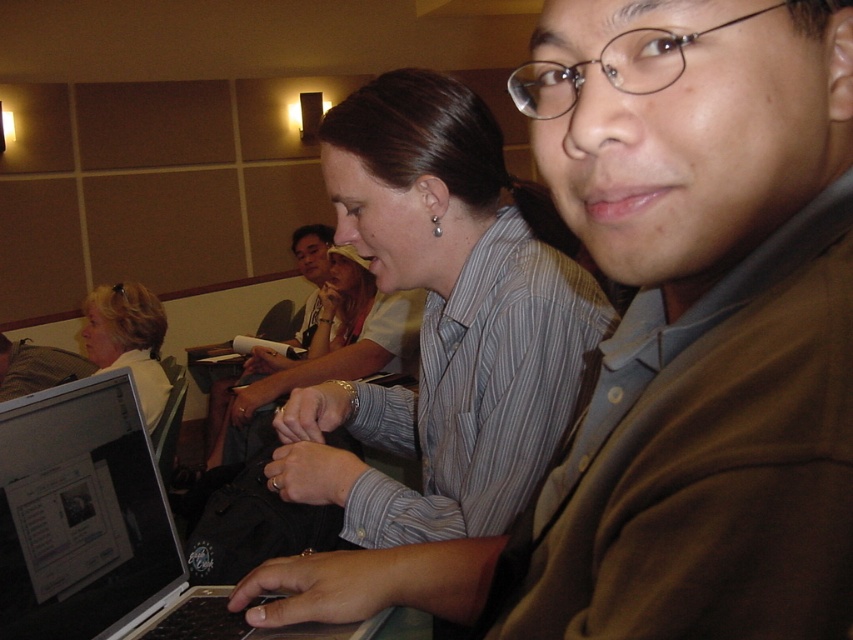
You are a photographer trying to capture a clear shot of both the brown cotton shirt at center and the matte white shirt at center. Since they are overlapping, which one should you adjust your focus to ensure the person in front is sharp?

The brown cotton shirt at center is in front of the matte white shirt at center, so adjusting focus on the brown cotton shirt at center will ensure the person in front is sharp.

You are a photographer trying to capture a clear photo of the silver metallic laptop at center. However, the brown cotton shirt at center is blocking your view. Can you move the shirt to get an unobstructed shot of the laptop?

The brown cotton shirt at center is positioned over the silver metallic laptop at center, so moving the shirt would allow an unobstructed view of the laptop.

You are standing in the meeting room and want to determine which of the two points, point (463, 396) or point (142, 372), is nearer to you. Based on the scene, which point is closer?

Point (463, 396) is closer to the viewer than point (142, 372).